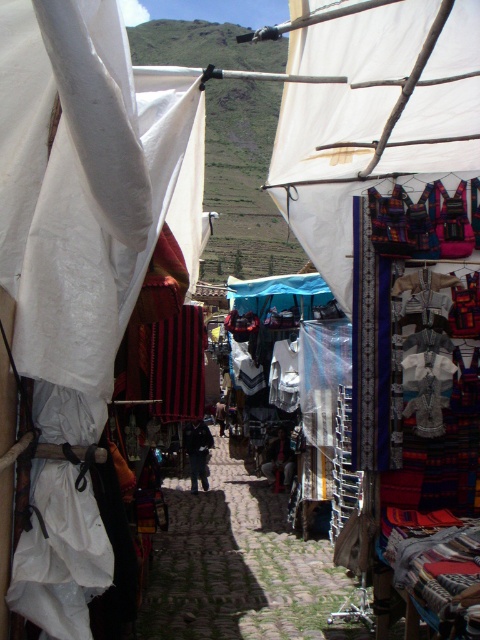
Is white fabric canopy at upper center smaller than cobblestone alley at center?

Yes, white fabric canopy at upper center is smaller than cobblestone alley at center.

Does white fabric canopy at upper center appear on the left side of cobblestone alley at center?

Incorrect, white fabric canopy at upper center is not on the left side of cobblestone alley at center.

Between point (459, 90) and point (156, 621), which one is positioned in front?

Point (459, 90) is more forward.

At what (x,y) coordinates should I click in order to perform the action: click on white fabric canopy at upper center. Please return your answer as a coordinate pair (x, y). The image size is (480, 640). Looking at the image, I should click on (372, 115).